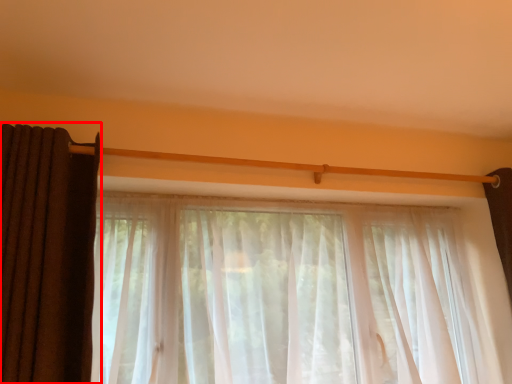
Question: From the image's perspective, considering the relative positions of curtain (annotated by the red box) and curtain in the image provided, where is curtain (annotated by the red box) located with respect to the staircase?

Choices:
 (A) above
 (B) below

Answer: (A)